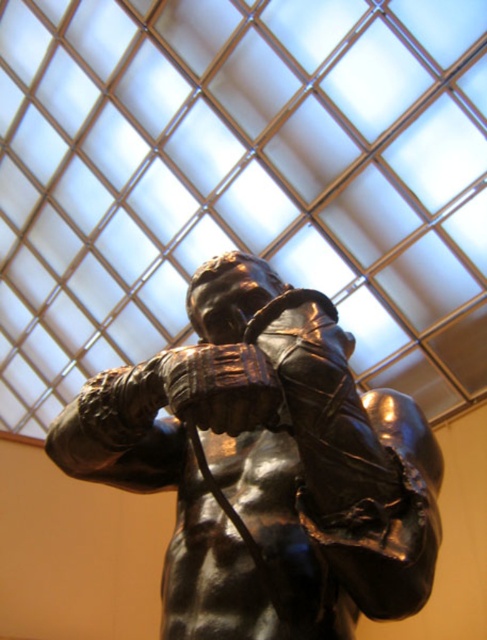
Question: Which object appears closest to the camera in this image?

Choices:
 (A) shiny brown leather boxing glove at center
 (B) shiny bronze statue at center

Answer: (B)

Question: Can you confirm if shiny bronze statue at center is thinner than shiny brown leather boxing glove at center?

Choices:
 (A) yes
 (B) no

Answer: (B)

Question: Can you confirm if shiny bronze statue at center is wider than shiny brown leather boxing glove at center?

Choices:
 (A) no
 (B) yes

Answer: (B)

Question: Does shiny bronze statue at center appear on the right side of shiny brown leather boxing glove at center?

Choices:
 (A) no
 (B) yes

Answer: (B)

Question: Which object appears farthest from the camera in this image?

Choices:
 (A) shiny brown leather boxing glove at center
 (B) shiny bronze statue at center

Answer: (A)